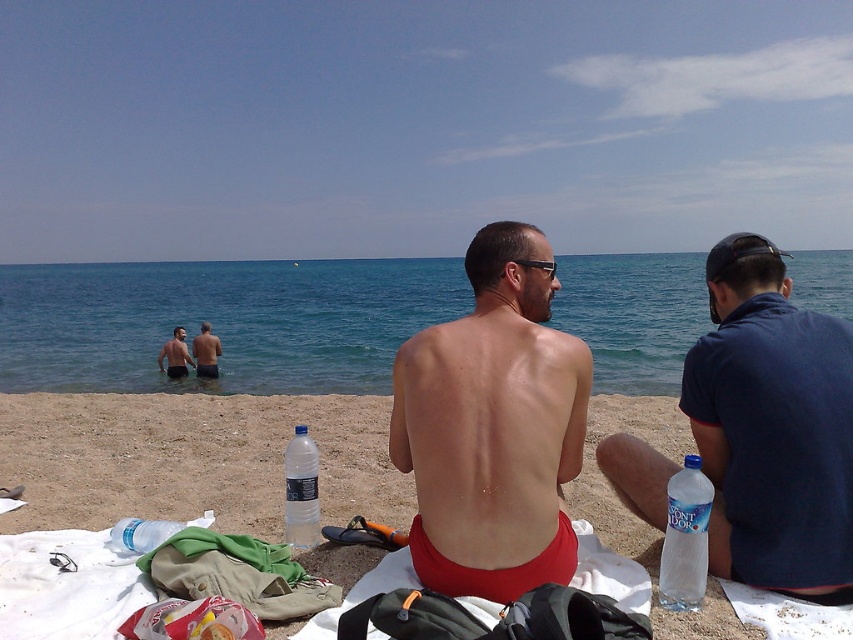
Question: Can you confirm if blue water at center is positioned below transparent plastic bottle at center?

Choices:
 (A) yes
 (B) no

Answer: (B)

Question: Based on their relative distances, which object is farther from the matte red shorts at center?

Choices:
 (A) clear plastic bottle at lower left
 (B) blue water at center
 (C) smooth skin torso at center

Answer: (B)

Question: Which point is closer to the camera taking this photo?

Choices:
 (A) (161, 538)
 (B) (215, 374)
 (C) (703, 561)
 (D) (448, 436)

Answer: (D)

Question: Does matte red shorts at center appear on the right side of smooth skin man at center?

Choices:
 (A) no
 (B) yes

Answer: (B)

Question: Can you confirm if transparent plastic bottle at center is smaller than smooth skin man at center?

Choices:
 (A) yes
 (B) no

Answer: (A)

Question: Which object is positioned farthest from the transparent plastic bottle at center?

Choices:
 (A) blue water at center
 (B) matte red shorts at center

Answer: (A)